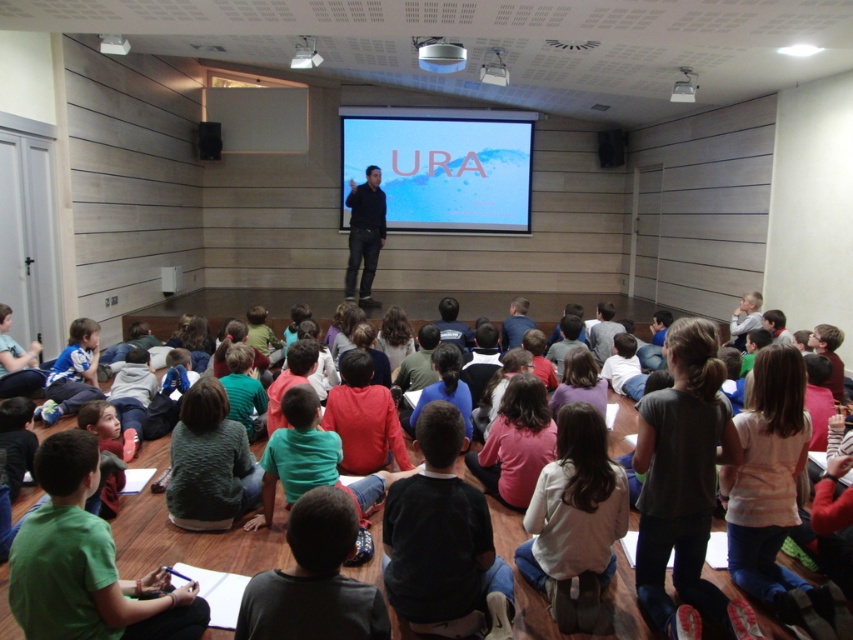
Based on the scene description, which object is taller between the white glossy projection screen at center and the black matte speaker at upper center?

The white glossy projection screen at center is taller than the black matte speaker at upper center according to the description.

You are a student sitting in the classroom and want to look at both the green matte shirt at lower left and the black matte speaker at upper right. Which object do you need to look down towards to see?

The green matte shirt at lower left is located below the black matte speaker at upper right, so you need to look down towards the green matte shirt at lower left to see it.

You are a student sitting in the classroom. The teacher asks you to compare the sizes of the white glossy projection screen at center and the black matte speaker at upper center. Which one is larger?

The white glossy projection screen at center is bigger than the black matte speaker at upper center.